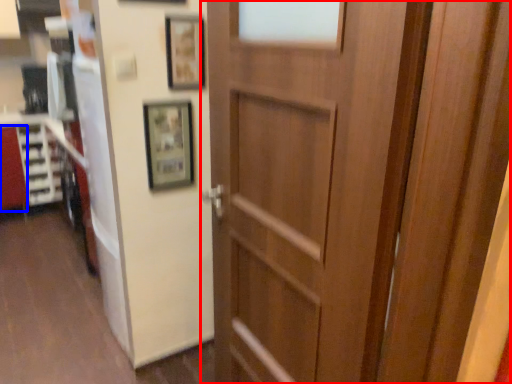
Question: Among these objects, which one is farthest to the camera, door (highlighted by a red box) or cabinetry (highlighted by a blue box)?

Choices:
 (A) door
 (B) cabinetry

Answer: (B)